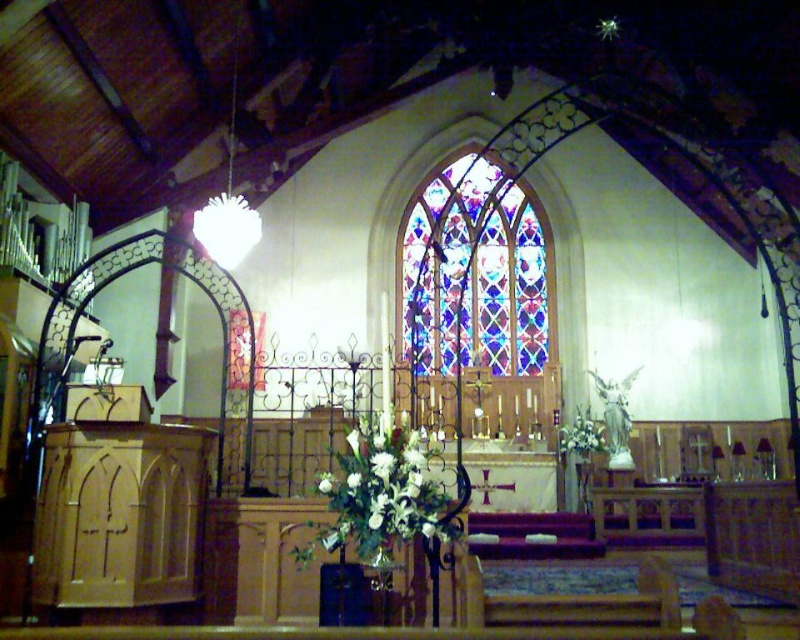
You are planning to place a new decorative item in the church altar area. The stained glass window at center and the white floral bouquet at center are already present. Which of these two items occupies more space in the altar area?

The stained glass window at center has a larger size compared to the white floral bouquet at center, so it occupies more space in the altar area.

You are a visitor standing at the entrance of the church and want to take a photo of both the stained glass window at center and the white floral bouquet at center. Which object should you focus on first if you want to capture both in the same frame without moving the camera?

The stained glass window at center is taller than the white floral bouquet at center, so you should focus on the stained glass window at center first to ensure it fits within the frame.